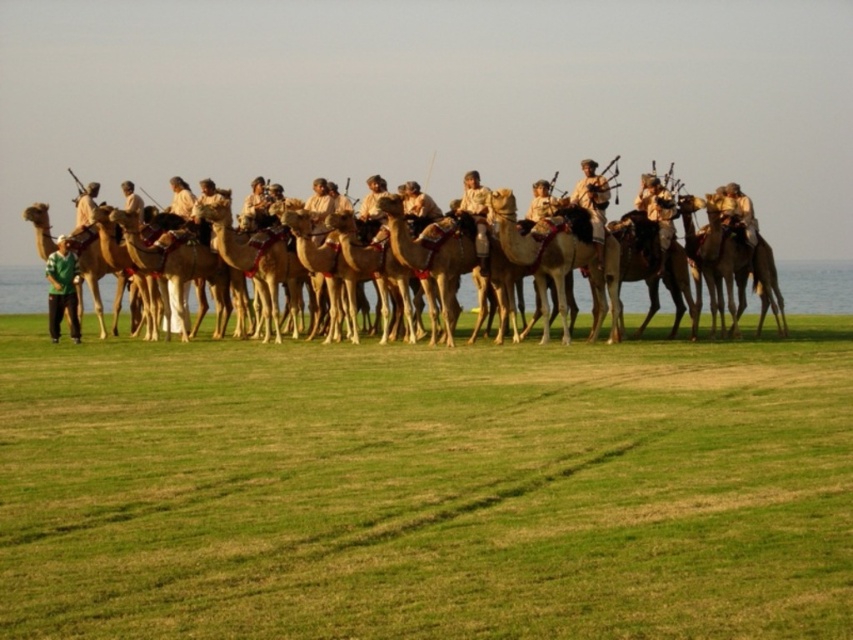
Question: Which point appears farthest from the camera in this image?

Choices:
 (A) (186, 195)
 (B) (68, 268)

Answer: (A)

Question: Among these objects, which one is nearest to the camera?

Choices:
 (A) green matte shirt at lower left
 (B) light brown fabric at center
 (C) camouflage fabric uniform at center
 (D) light brown leather bagpipe at center

Answer: (C)

Question: Among these points, which one is farthest from the camera?

Choices:
 (A) (135, 202)
 (B) (86, 221)
 (C) (703, 524)

Answer: (A)

Question: Does green grass at lower center have a lesser width compared to light brown leather bagpipe at center?

Choices:
 (A) yes
 (B) no

Answer: (B)

Question: Is light brown camel at center positioned behind green matte shirt at lower left?

Choices:
 (A) yes
 (B) no

Answer: (B)

Question: Where is camouflage fabric uniform at center located in relation to light brown leather camel at left in the image?

Choices:
 (A) above
 (B) below

Answer: (B)